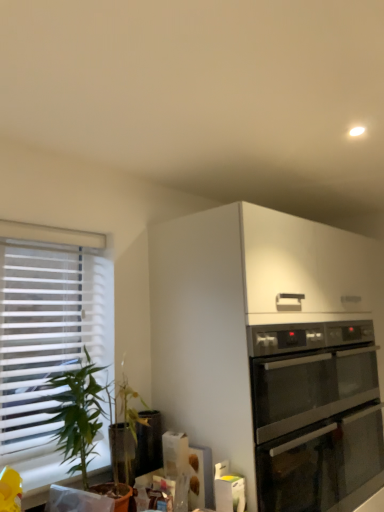
This screenshot has width=384, height=512. What do you see at coordinates (272, 351) in the screenshot?
I see `stainless steel oven at lower right` at bounding box center [272, 351].

Measure the distance between satin silver oven at upper right and camera.

satin silver oven at upper right and camera are 1.59 meters apart.

You are a GUI agent. You are given a task and a screenshot of the screen. Output one action in this format:
    pyautogui.click(x=<x>, y=<y>)
    Task: Click on the green leafy plant at left
    The image size is (384, 512).
    Given the screenshot: What is the action you would take?
    pyautogui.click(x=78, y=413)

Considering the sizes of objects green leafy plant at left and white blinds at left in the image provided, who is wider, green leafy plant at left or white blinds at left?

With larger width is green leafy plant at left.

Considering the relative positions of green leafy plant at left and white blinds at left in the image provided, is green leafy plant at left in front of white blinds at left?

That is True.

From the image's perspective, is green leafy plant at left under white blinds at left?

Correct, green leafy plant at left appears lower than white blinds at left in the image.

From the picture: Is green leafy plant at left looking in the opposite direction of white blinds at left?

Yes.

Is satin silver oven at upper right not inside white blinds at left?

That's correct, satin silver oven at upper right is outside of white blinds at left.

Is satin silver oven at upper right in contact with white blinds at left?

No, satin silver oven at upper right is not beside white blinds at left.

Find the location of `window positioned vertically above the satin silver oven at upper right (from a real-world perspective)`. window positioned vertically above the satin silver oven at upper right (from a real-world perspective) is located at coordinates pos(47,334).

Looking at this image, is satin silver oven at upper right turned away from white blinds at left?

No, satin silver oven at upper right is not facing away from white blinds at left.

Does point (337, 423) come in front of point (98, 393)?

That is False.

Who is shorter, satin silver oven at upper right or green leafy plant at left?

Standing shorter between the two is green leafy plant at left.

In the scene shown: Does satin silver oven at upper right come in front of green leafy plant at left?

No, satin silver oven at upper right is further to the viewer.

Find the location of a particular element. oven below the green leafy plant at left (from the image's perspective) is located at coordinates (315, 414).

Does green leafy plant at left have a larger size compared to satin silver oven at upper right?

Incorrect, green leafy plant at left is not larger than satin silver oven at upper right.

Considering the sizes of green leafy plant at left and satin silver oven at upper right in the image, is green leafy plant at left taller or shorter than satin silver oven at upper right?

green leafy plant at left is shorter than satin silver oven at upper right.

Which object is thinner, stainless steel oven at lower right or satin silver oven at upper right?

Thinner between the two is satin silver oven at upper right.

Is stainless steel oven at lower right in front of or behind satin silver oven at upper right in the image?

stainless steel oven at lower right is in front of satin silver oven at upper right.

Can you tell me how much stainless steel oven at lower right and satin silver oven at upper right differ in facing direction?

The angle between the facing direction of stainless steel oven at lower right and the facing direction of satin silver oven at upper right is 0.355 degrees.

Between stainless steel oven at lower right and satin silver oven at upper right, which one appears on the left side from the viewer's perspective?

stainless steel oven at lower right.

Considering the relative positions of satin silver oven at upper right and stainless steel oven at lower right in the image provided, is satin silver oven at upper right behind stainless steel oven at lower right?

Yes, satin silver oven at upper right is behind stainless steel oven at lower right.

Which object is positioned more to the left, satin silver oven at upper right or stainless steel oven at lower right?

stainless steel oven at lower right is more to the left.

Which is less distant, [289,490] or [293,250]?

The point [293,250] is in front.

Is satin silver oven at upper right thinner than stainless steel oven at lower right?

Yes, satin silver oven at upper right is thinner than stainless steel oven at lower right.

Is point (43, 253) closer to viewer compared to point (307, 392)?

Yes, point (43, 253) is closer to viewer.

Between white blinds at left and satin silver oven at upper right, which one has less height?

satin silver oven at upper right.

Would you say white blinds at left is inside or outside satin silver oven at upper right?

white blinds at left cannot be found inside satin silver oven at upper right.

Locate an element on the screen. The image size is (384, 512). window above the green leafy plant at left (from the image's perspective) is located at coordinates (47, 334).

Where is `oven behind the white blinds at left`? oven behind the white blinds at left is located at coordinates (315, 414).

Estimate the real-world distances between objects in this image. Which object is closer to satin silver oven at upper right, stainless steel oven at lower right or white blinds at left?

stainless steel oven at lower right is closer to satin silver oven at upper right.

Considering their positions, is stainless steel oven at lower right positioned closer to green leafy plant at left than white blinds at left?

Among the two, white blinds at left is located nearer to green leafy plant at left.

Considering their positions, is green leafy plant at left positioned further to white blinds at left than stainless steel oven at lower right?

Among the two, stainless steel oven at lower right is located further to white blinds at left.

Which object lies nearer to the anchor point green leafy plant at left, satin silver oven at upper right or stainless steel oven at lower right?

stainless steel oven at lower right is positioned closer to the anchor green leafy plant at left.

Considering their positions, is green leafy plant at left positioned further to satin silver oven at upper right than white blinds at left?

Based on the image, white blinds at left appears to be further to satin silver oven at upper right.

Based on the photo, from the image, which object appears to be nearer to white blinds at left, satin silver oven at upper right or stainless steel oven at lower right?

stainless steel oven at lower right is closer to white blinds at left.

Considering their positions, is stainless steel oven at lower right positioned closer to white blinds at left than green leafy plant at left?

Among the two, green leafy plant at left is located nearer to white blinds at left.

Considering their positions, is stainless steel oven at lower right positioned further to satin silver oven at upper right than green leafy plant at left?

green leafy plant at left is further to satin silver oven at upper right.

This screenshot has width=384, height=512. Find the location of `cabinetry between white blinds at left and satin silver oven at upper right`. cabinetry between white blinds at left and satin silver oven at upper right is located at coordinates (272, 351).

Image resolution: width=384 pixels, height=512 pixels. In order to click on houseplant situated between white blinds at left and stainless steel oven at lower right from left to right in this screenshot , I will do `click(78, 413)`.

This screenshot has height=512, width=384. I want to click on houseplant located between white blinds at left and satin silver oven at upper right in the left-right direction, so click(x=78, y=413).

Image resolution: width=384 pixels, height=512 pixels. Find the location of `cabinetry between green leafy plant at left and satin silver oven at upper right`. cabinetry between green leafy plant at left and satin silver oven at upper right is located at coordinates (272, 351).